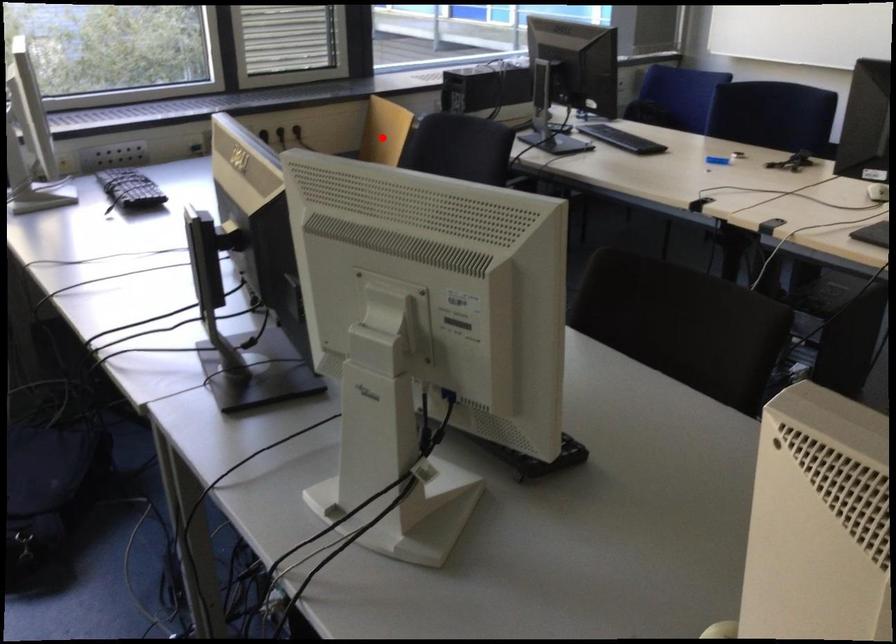
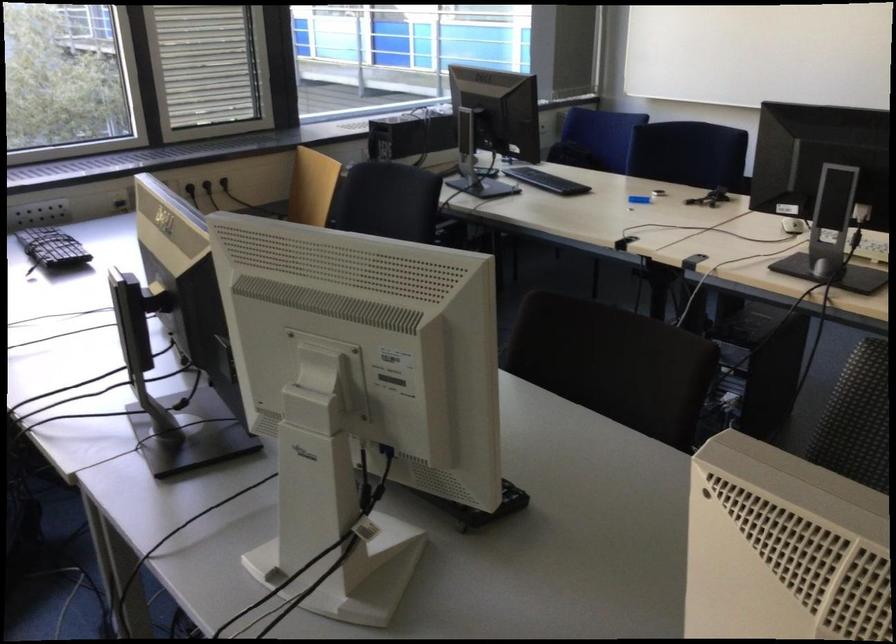
Find the pixel in the second image that matches the highlighted location in the first image.

(312, 187)